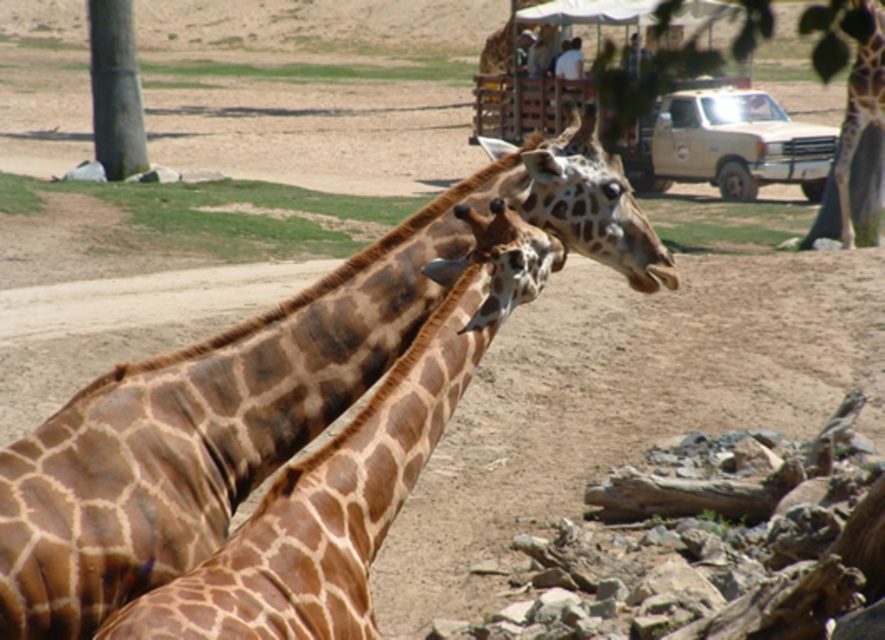
You are a zookeeper who needs to place a new feeding station between the green bark tree at left and the brown spotted giraffe at right. Based on their positions, which side of the feeding station should be closer to the tree?

The feeding station should have its left side closer to the green bark tree at left since it is positioned to the left of the brown spotted giraffe at right.

Consider the image. You are a zookeeper trying to determine if a new giraffe enclosure will fit both the brown spotted giraffe at center and the green bark tree at left. Given that the enclosure height must accommodate the tallest object, which one requires the taller space?

The green bark tree at left requires taller space because the brown spotted giraffe at center is not as tall as the green bark tree at left.

You are a zookeeper observing the brown spotted giraffe at center and the green bark tree at left. Which object is positioned higher in the image?

The green bark tree at left is positioned higher in the image than the brown spotted giraffe at center.